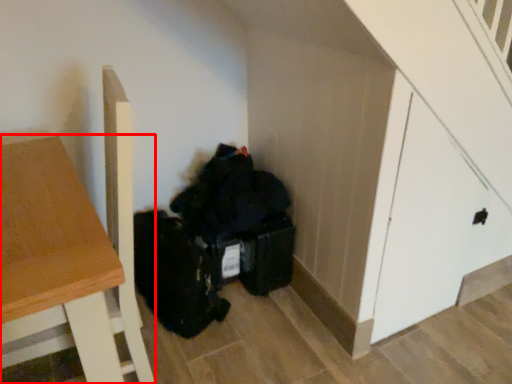
Question: From the image's perspective, where is table (annotated by the red box) located in relation to door in the image?

Choices:
 (A) above
 (B) below

Answer: (B)